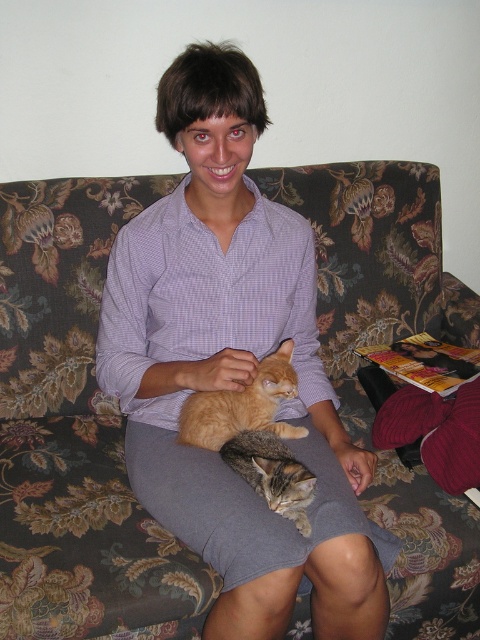
Question: Estimate the real-world distances between objects in this image. Which object is farther from the floral fabric couch at center?

Choices:
 (A) tabby fur cat at center
 (B) orange fur cat at center

Answer: (A)

Question: Is orange fur cat at center to the right of tabby fur cat at center from the viewer's perspective?

Choices:
 (A) yes
 (B) no

Answer: (B)

Question: Does floral fabric couch at center have a smaller size compared to orange fur cat at center?

Choices:
 (A) yes
 (B) no

Answer: (B)

Question: Does orange fur cat at center have a lesser width compared to tabby fur cat at center?

Choices:
 (A) no
 (B) yes

Answer: (A)

Question: Among these objects, which one is nearest to the camera?

Choices:
 (A) tabby fur cat at center
 (B) floral fabric couch at center

Answer: (A)

Question: Which point is farther to the camera?

Choices:
 (A) floral fabric couch at center
 (B) tabby fur cat at center

Answer: (A)